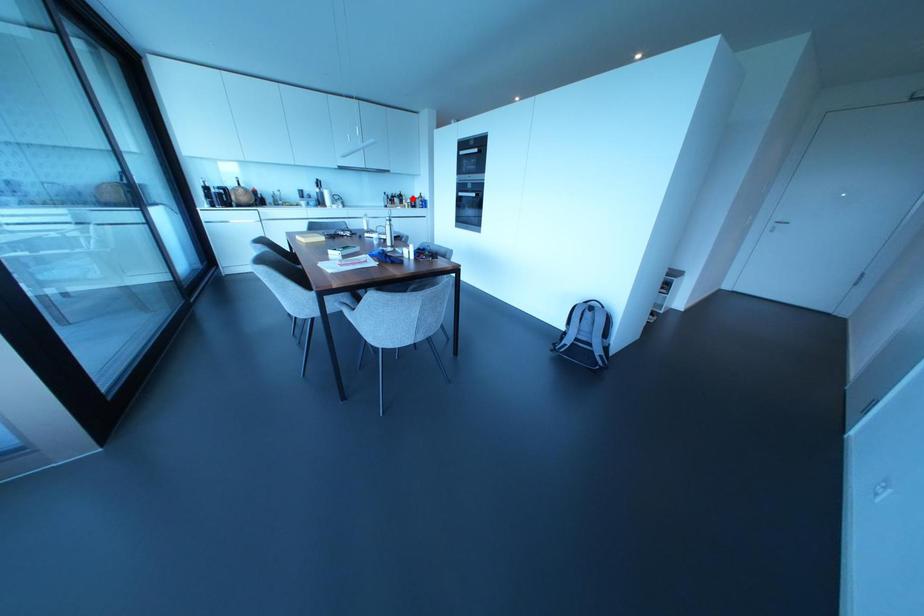
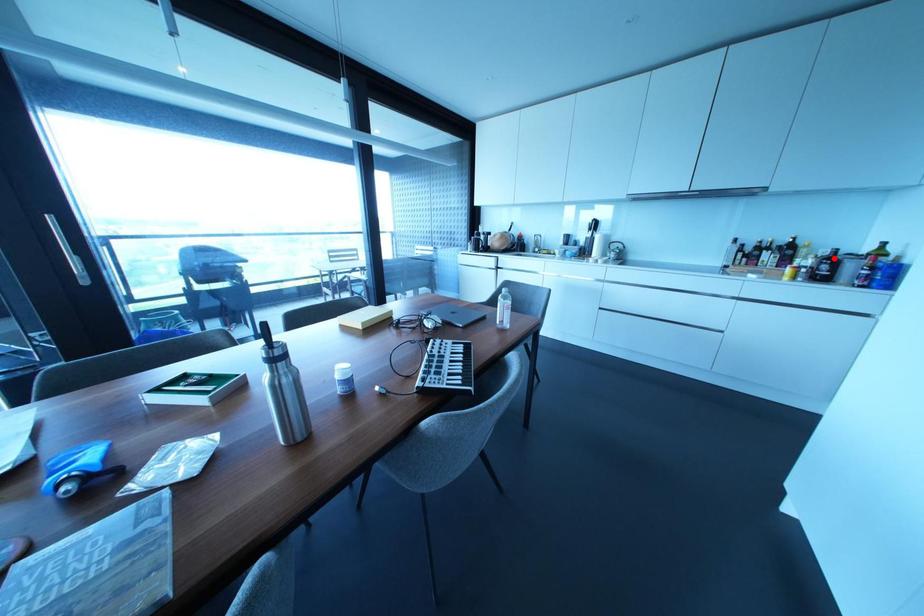
Based on the photo, I am providing you with two images of the same scene from different viewpoints. A red point is marked on the first image and another point is marked on the second image. Are the points marked in image1 and image2 representing the same 3D position?

Yes